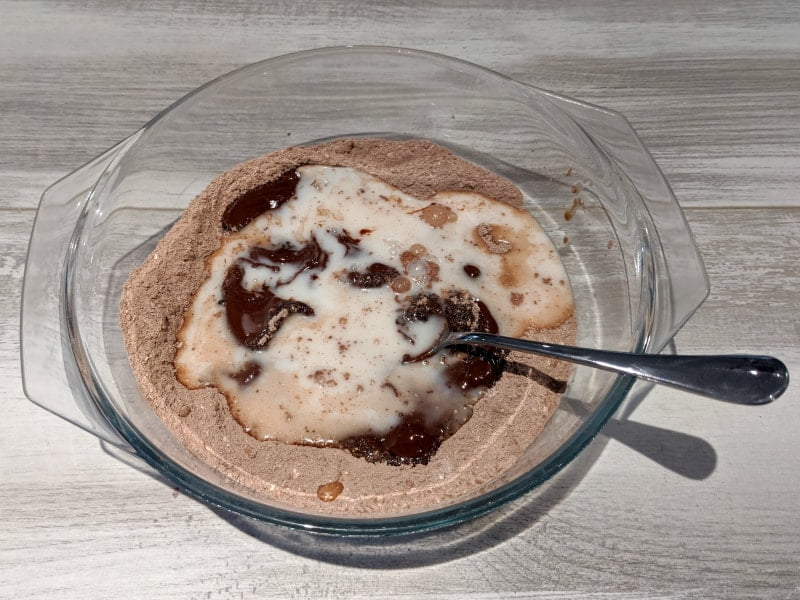
At what (x,y) coordinates should I click in order to perform the action: click on gray table. Please return your answer as a coordinate pair (x, y). This screenshot has width=800, height=600. Looking at the image, I should click on (672, 109).